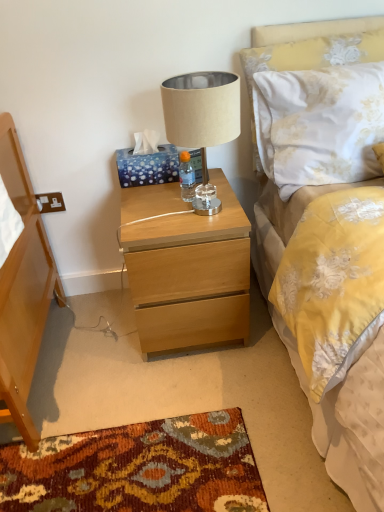
Where is `vacant space positioned to the left of light wood nightstand at center`? This screenshot has height=512, width=384. vacant space positioned to the left of light wood nightstand at center is located at coordinates (86, 343).